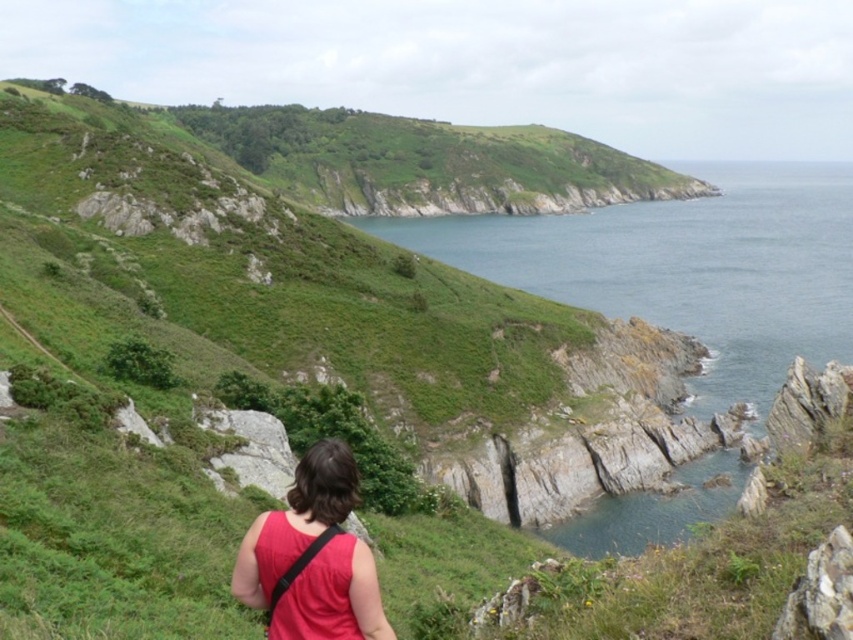
You are standing at the starting point of the grassy path in the foreground. You want to reach the blue water at upper right. Which direction should you walk to get there?

You should walk towards the upper right direction to reach the blue water at upper right as it is located at point (x=688, y=268).

You are standing at the red matte tank top at lower center and want to reach the blue water at upper right. Which direction should you move to get there?

To reach the blue water at upper right from the red matte tank top at lower center, you should move to the right since the blue water at upper right is located to the right of the red matte tank top at lower center.